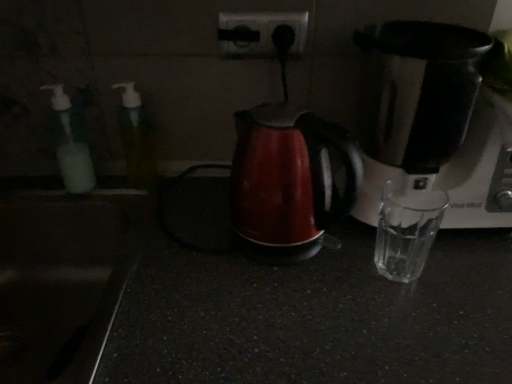
What is the approximate height of black glossy sink at lower left?

The height of black glossy sink at lower left is 9.42 inches.

In order to click on satin black coffee maker at right in this screenshot , I will do `click(429, 119)`.

At what (x,y) coordinates should I click in order to perform the action: click on matte red kettle at center. Please return your answer as a coordinate pair (x, y). The image size is (512, 384). Looking at the image, I should click on (288, 182).

The image size is (512, 384). I want to click on black plastic power plugs and sockets at upper center, so click(x=259, y=33).

The height and width of the screenshot is (384, 512). Find the location of `black glossy sink at lower left`. black glossy sink at lower left is located at coordinates (60, 282).

Considering their positions, is matte red kettle at center located in front of or behind translucent plastic soap dispenser at left, the 1th bottle viewed from the left?

matte red kettle at center is in front of translucent plastic soap dispenser at left, the 1th bottle viewed from the left.

Is matte red kettle at center not within translucent plastic soap dispenser at left, the 2th bottle positioned from the right?

Yes, matte red kettle at center is not within translucent plastic soap dispenser at left, the 2th bottle positioned from the right.

Considering the sizes of objects matte red kettle at center and translucent plastic soap dispenser at left, the 2th bottle positioned from the right, in the image provided, who is thinner, matte red kettle at center or translucent plastic soap dispenser at left, the 2th bottle positioned from the right,?

Thinner between the two is translucent plastic soap dispenser at left, the 2th bottle positioned from the right.

Does black plastic power plugs and sockets at upper center have a lesser width compared to translucent plastic bottle at left, placed as the first bottle when sorted from right to left?

Indeed, black plastic power plugs and sockets at upper center has a lesser width compared to translucent plastic bottle at left, placed as the first bottle when sorted from right to left.

From the image's perspective, which is below, black plastic power plugs and sockets at upper center or translucent plastic bottle at left, which appears as the second bottle when viewed from the left?

From the image's view, translucent plastic bottle at left, which appears as the second bottle when viewed from the left, is below.

From a real-world perspective, does black plastic power plugs and sockets at upper center stand above translucent plastic bottle at left, which appears as the second bottle when viewed from the left?

Yes.

Is translucent plastic soap dispenser at left, the 1th bottle viewed from the left, aimed at satin black coffee maker at right?

No.

Is translucent plastic soap dispenser at left, the 2th bottle positioned from the right, positioned beyond the bounds of satin black coffee maker at right?

translucent plastic soap dispenser at left, the 2th bottle positioned from the right, is positioned outside satin black coffee maker at right.

Where is `coffee maker that appears in front of the translucent plastic soap dispenser at left, the 2th bottle positioned from the right`? coffee maker that appears in front of the translucent plastic soap dispenser at left, the 2th bottle positioned from the right is located at coordinates (429, 119).

Is translucent plastic bottle at left, placed as the first bottle when sorted from right to left, with matte red kettle at center?

There is a gap between translucent plastic bottle at left, placed as the first bottle when sorted from right to left, and matte red kettle at center.

From a real-world perspective, is translucent plastic bottle at left, which appears as the second bottle when viewed from the left, on top of matte red kettle at center?

Yes.

Between point (134, 135) and point (316, 207), which one is positioned in front?

The point (316, 207) is more forward.

How different are the orientations of translucent plastic bottle at left, placed as the first bottle when sorted from right to left, and matte red kettle at center in degrees?

0.00658 degrees.

From a real-world perspective, relative to black plastic power plugs and sockets at upper center, is translucent plastic bottle at left, placed as the first bottle when sorted from right to left, vertically above or below?

translucent plastic bottle at left, placed as the first bottle when sorted from right to left, is situated lower than black plastic power plugs and sockets at upper center in the real world.

Is translucent plastic bottle at left, placed as the first bottle when sorted from right to left, looking in the opposite direction of black plastic power plugs and sockets at upper center?

translucent plastic bottle at left, placed as the first bottle when sorted from right to left, is not turned away from black plastic power plugs and sockets at upper center.

How much distance is there between translucent plastic bottle at left, which appears as the second bottle when viewed from the left, and black plastic power plugs and sockets at upper center?

translucent plastic bottle at left, which appears as the second bottle when viewed from the left, and black plastic power plugs and sockets at upper center are 10.02 inches apart.

From the image's perspective, is satin black coffee maker at right located above or below matte red kettle at center?

Clearly, from the image's perspective, satin black coffee maker at right is above matte red kettle at center.

Is point (483, 129) positioned after point (297, 221)?

Yes, it is behind point (297, 221).

This screenshot has height=384, width=512. I want to click on coffee maker in front of the matte red kettle at center, so click(x=429, y=119).

How different are the orientations of satin black coffee maker at right and matte red kettle at center in degrees?

The facing directions of satin black coffee maker at right and matte red kettle at center are 0.000501 degrees apart.

Could you tell me if translucent plastic bottle at left, placed as the first bottle when sorted from right to left, is turned towards black glossy sink at lower left?

No.

Is translucent plastic bottle at left, which appears as the second bottle when viewed from the left, wider than black glossy sink at lower left?

No.

From a real-world perspective, is translucent plastic bottle at left, which appears as the second bottle when viewed from the left, over black glossy sink at lower left?

Correct, in the physical world, translucent plastic bottle at left, which appears as the second bottle when viewed from the left, is higher than black glossy sink at lower left.

Which object is positioned more to the right, translucent plastic bottle at left, placed as the first bottle when sorted from right to left, or black glossy sink at lower left?

Positioned to the right is translucent plastic bottle at left, placed as the first bottle when sorted from right to left.

Find the location of a particular element. The width and height of the screenshot is (512, 384). bottle below the matte red kettle at center (from a real-world perspective) is located at coordinates (70, 145).

You are a GUI agent. You are given a task and a screenshot of the screen. Output one action in this format:
    pyautogui.click(x=<x>, y=<y>)
    Task: Click on the bottle that is the 2nd one when counting forward from the black plastic power plugs and sockets at upper center
    
    Given the screenshot: What is the action you would take?
    pyautogui.click(x=136, y=139)

When comparing their distances from black plastic power plugs and sockets at upper center, does translucent plastic bottle at left, which appears as the second bottle when viewed from the left, or translucent plastic soap dispenser at left, the 1th bottle viewed from the left, seem closer?

translucent plastic bottle at left, which appears as the second bottle when viewed from the left.

From the image, which object appears to be nearer to black plastic power plugs and sockets at upper center, matte red kettle at center or satin black coffee maker at right?

matte red kettle at center.

Considering their positions, is satin black coffee maker at right positioned further to translucent plastic soap dispenser at left, the 2th bottle positioned from the right, than black glossy sink at lower left?

The object further to translucent plastic soap dispenser at left, the 2th bottle positioned from the right, is satin black coffee maker at right.

Based on their spatial positions, is black glossy sink at lower left or black plastic power plugs and sockets at upper center closer to translucent plastic soap dispenser at left, the 1th bottle viewed from the left?

black glossy sink at lower left lies closer to translucent plastic soap dispenser at left, the 1th bottle viewed from the left, than the other object.

Which object lies further to the anchor point satin black coffee maker at right, matte red kettle at center or translucent plastic bottle at left, which appears as the second bottle when viewed from the left?

Among the two, translucent plastic bottle at left, which appears as the second bottle when viewed from the left, is located further to satin black coffee maker at right.

When comparing their distances from satin black coffee maker at right, does black glossy sink at lower left or matte red kettle at center seem closer?

matte red kettle at center is closer to satin black coffee maker at right.

Considering their positions, is translucent plastic bottle at left, placed as the first bottle when sorted from right to left, positioned closer to translucent plastic soap dispenser at left, the 2th bottle positioned from the right, than satin black coffee maker at right?

translucent plastic bottle at left, placed as the first bottle when sorted from right to left, lies closer to translucent plastic soap dispenser at left, the 2th bottle positioned from the right, than the other object.

Based on their spatial positions, is translucent plastic soap dispenser at left, the 1th bottle viewed from the left, or black plastic power plugs and sockets at upper center closer to black glossy sink at lower left?

translucent plastic soap dispenser at left, the 1th bottle viewed from the left, lies closer to black glossy sink at lower left than the other object.

The image size is (512, 384). I want to click on bottle situated between translucent plastic soap dispenser at left, the 1th bottle viewed from the left, and matte red kettle at center from left to right, so click(136, 139).

Locate an element on the screen. kettle between translucent plastic soap dispenser at left, the 1th bottle viewed from the left, and satin black coffee maker at right is located at coordinates (288, 182).

At what (x,y) coordinates should I click in order to perform the action: click on power plugs and sockets between translucent plastic soap dispenser at left, the 1th bottle viewed from the left, and satin black coffee maker at right from left to right. Please return your answer as a coordinate pair (x, y). This screenshot has width=512, height=384. Looking at the image, I should click on point(259,33).

Find the location of a particular element. bottle between translucent plastic soap dispenser at left, the 2th bottle positioned from the right, and satin black coffee maker at right is located at coordinates (136, 139).